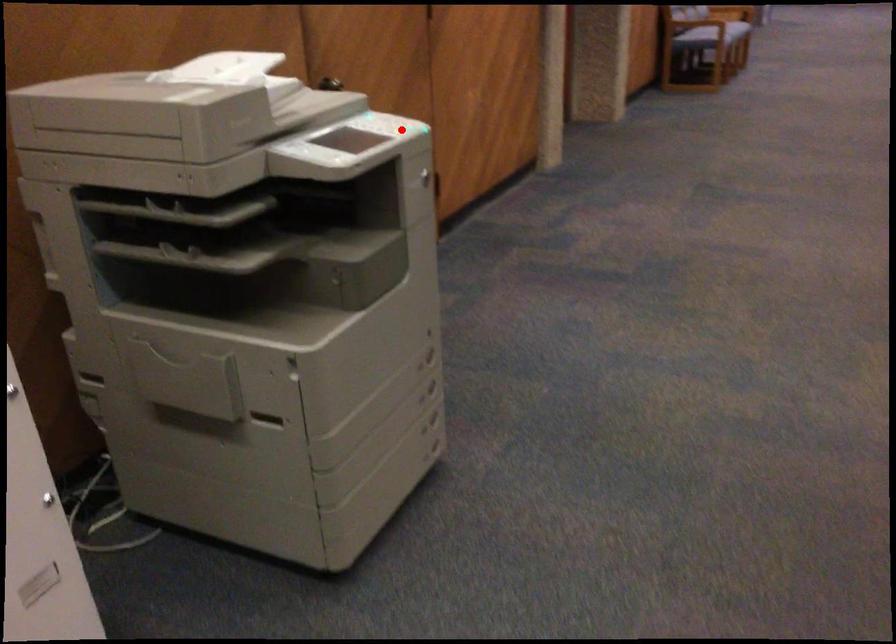
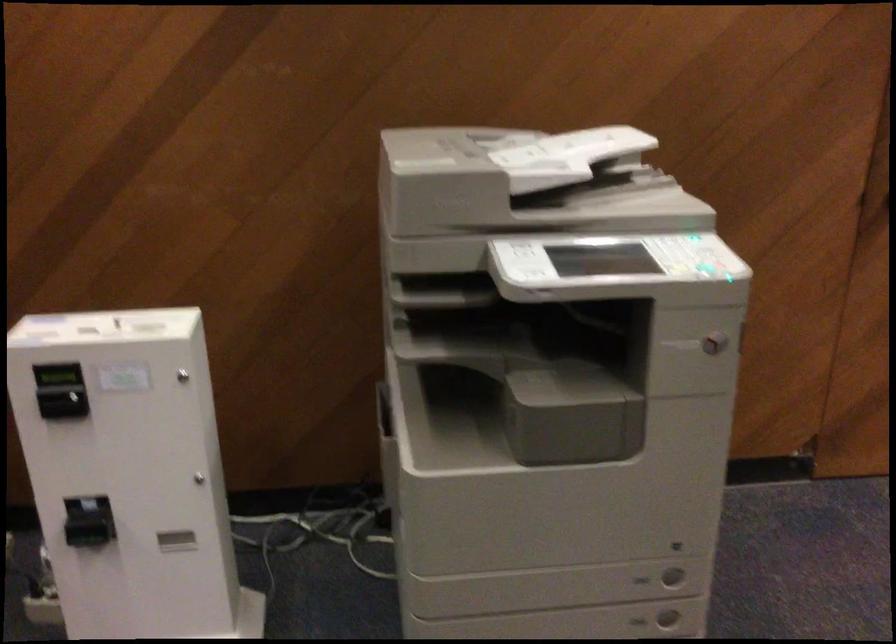
Question: I am providing you with two images of the same scene from different viewpoints. A red point is shown in image1. For the corresponding object point in image2, is it positioned nearer or farther from the camera?

Choices:
 (A) Nearer
 (B) Farther

Answer: (A)